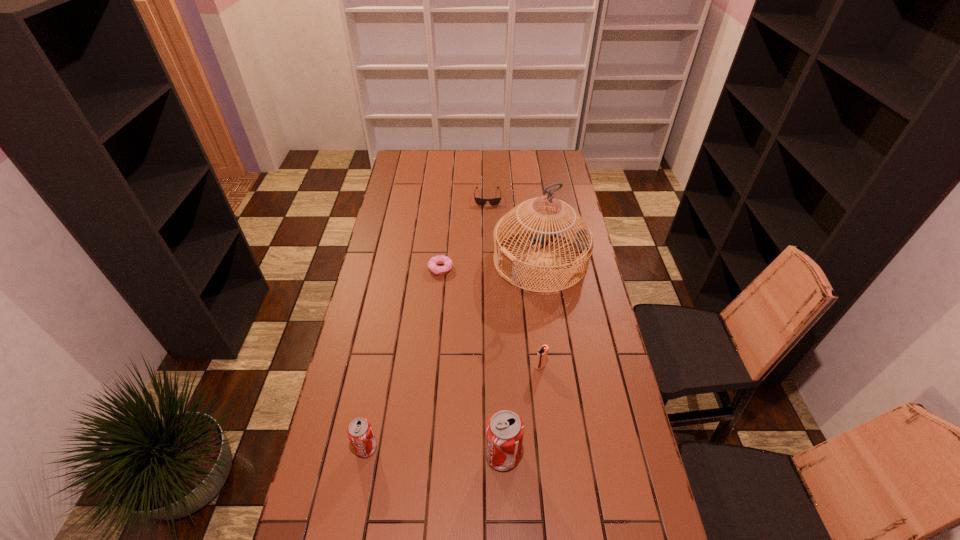
This screenshot has height=540, width=960. Find the location of `the fourth shortest object`. the fourth shortest object is located at coordinates (360, 433).

The width and height of the screenshot is (960, 540). In order to click on the leftmost object in this screenshot , I will do `click(360, 433)`.

Locate an element on the screen. The image size is (960, 540). the right soda can is located at coordinates (504, 431).

This screenshot has width=960, height=540. I want to click on the taller soda can, so click(x=504, y=431).

This screenshot has width=960, height=540. What are the coordinates of `igniter` in the screenshot? It's located at (542, 354).

At what (x,y) coordinates should I click in order to perform the action: click on the third nearest object. Please return your answer as a coordinate pair (x, y). The width and height of the screenshot is (960, 540). Looking at the image, I should click on (542, 354).

At what (x,y) coordinates should I click in order to perform the action: click on the fifth object from right to left. Please return your answer as a coordinate pair (x, y). This screenshot has width=960, height=540. Looking at the image, I should click on (440, 259).

At what (x,y) coordinates should I click in order to perform the action: click on the farthest object. Please return your answer as a coordinate pair (x, y). Looking at the image, I should click on [x=480, y=201].

Find the location of a particular element. Image resolution: width=960 pixels, height=540 pixels. the tallest object is located at coordinates click(x=582, y=241).

Find the location of `blank space located on the back of the left soda can`. blank space located on the back of the left soda can is located at coordinates (374, 402).